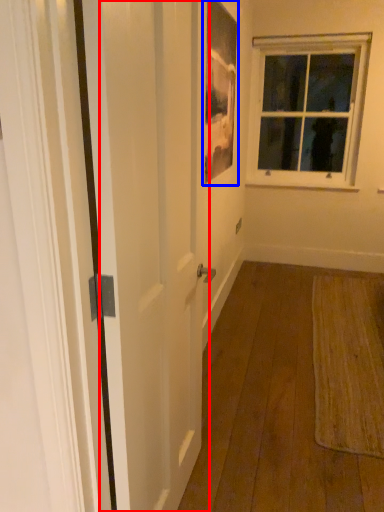
Question: Which object is further to the camera taking this photo, screen door (highlighted by a red box) or picture frame (highlighted by a blue box)?

Choices:
 (A) screen door
 (B) picture frame

Answer: (B)